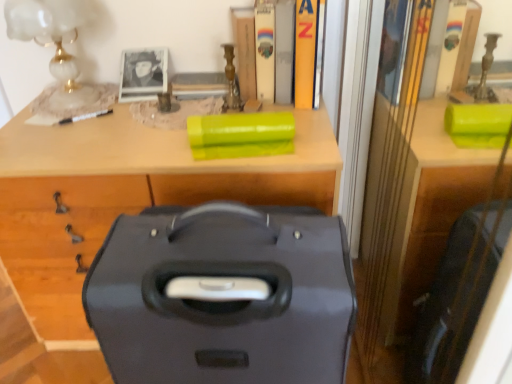
Describe the element at coordinates (245, 50) in the screenshot. I see `wooden book at upper center, the 1th book positioned from the left` at that location.

Describe the element at coordinates (53, 38) in the screenshot. The image size is (512, 384). I see `white marble table lamp at upper left` at that location.

Locate an element on the screen. white marble table lamp at upper left is located at coordinates (53, 38).

Where is `matte black suitcase at center`? The width and height of the screenshot is (512, 384). matte black suitcase at center is located at coordinates (127, 196).

Describe the element at coordinates (223, 297) in the screenshot. I see `matte black suitcase at center` at that location.

The width and height of the screenshot is (512, 384). What do you see at coordinates (265, 50) in the screenshot?
I see `hardcover book at upper center, which is counted as the third book, starting from the right` at bounding box center [265, 50].

Image resolution: width=512 pixels, height=384 pixels. I want to click on yellow matte book at upper center, the first book viewed from the right, so click(x=308, y=53).

Looking at the image, does white marble table lamp at upper left seem bigger or smaller compared to hardcover book at upper center, which is counted as the second book, starting from the right?

Considering their sizes, white marble table lamp at upper left takes up more space than hardcover book at upper center, which is counted as the second book, starting from the right.

Which is correct: white marble table lamp at upper left is inside hardcover book at upper center, which is counted as the second book, starting from the right, or outside of it?

white marble table lamp at upper left is outside hardcover book at upper center, which is counted as the second book, starting from the right.

Looking at this image, from the image's perspective, which is below, white marble table lamp at upper left or hardcover book at upper center, the third book from the left?

white marble table lamp at upper left is shown below in the image.

At what (x,y) coordinates should I click in order to perform the action: click on table lamp lying on the left of hardcover book at upper center, which is counted as the second book, starting from the right. Please return your answer as a coordinate pair (x, y). This screenshot has width=512, height=384. Looking at the image, I should click on (53, 38).

Would you say matte black suitcase at center is inside or outside hardcover book at upper center, which ranks as the 2th book in left-to-right order?

matte black suitcase at center is not enclosed by hardcover book at upper center, which ranks as the 2th book in left-to-right order.

From a real-world perspective, which is physically below, matte black suitcase at center or hardcover book at upper center, which ranks as the 2th book in left-to-right order?

matte black suitcase at center is physically lower.

From the image's perspective, is matte black suitcase at center located beneath hardcover book at upper center, which ranks as the 2th book in left-to-right order?

Correct, matte black suitcase at center appears lower than hardcover book at upper center, which ranks as the 2th book in left-to-right order, in the image.

Looking at this image, from the image's perspective, is hardcover book at upper center, which ranks as the 2th book in left-to-right order, above hardcover book at upper center, which is counted as the second book, starting from the right?

No.

Looking at this image, is hardcover book at upper center, which is counted as the third book, starting from the right, next to hardcover book at upper center, which is counted as the second book, starting from the right, and touching it?

Yes.

In the image, is hardcover book at upper center, which ranks as the 2th book in left-to-right order, on the left side or the right side of hardcover book at upper center, the third book from the left?

Based on their positions, hardcover book at upper center, which ranks as the 2th book in left-to-right order, is located to the left of hardcover book at upper center, the third book from the left.

Considering the positions of point (269, 63) and point (287, 20), is point (269, 63) closer or farther from the camera than point (287, 20)?

Clearly, point (269, 63) is more distant from the camera than point (287, 20).

From the hardcover book at upper center, which ranks as the 2th book in left-to-right order, count 2nd books forward and point to it. Please provide its 2D coordinates.

[(308, 53)]

From the image's perspective, which is below, hardcover book at upper center, which is counted as the third book, starting from the right, or yellow matte book at upper center, the first book viewed from the right?

hardcover book at upper center, which is counted as the third book, starting from the right, appears lower in the image.

Considering the relative sizes of hardcover book at upper center, which ranks as the 2th book in left-to-right order, and yellow matte book at upper center, the first book viewed from the right, in the image provided, is hardcover book at upper center, which ranks as the 2th book in left-to-right order, wider than yellow matte book at upper center, the first book viewed from the right,?

No, hardcover book at upper center, which ranks as the 2th book in left-to-right order, is not wider than yellow matte book at upper center, the first book viewed from the right.

From a real-world perspective, between hardcover book at upper center, which is counted as the third book, starting from the right, and yellow matte book at upper center, the fourth book positioned from the left, who is vertically lower?

From a 3D spatial view, hardcover book at upper center, which is counted as the third book, starting from the right, is below.

Does wooden book at upper center, the 1th book positioned from the left, appear on the left side of matte black suitcase at center?

Incorrect, wooden book at upper center, the 1th book positioned from the left, is not on the left side of matte black suitcase at center.

From the image's perspective, between wooden book at upper center, the 1th book positioned from the left, and matte black suitcase at center, which one is located above?

wooden book at upper center, the 1th book positioned from the left, is shown above in the image.

Considering their positions, is wooden book at upper center, which ranks as the fourth book in right-to-left order, located in front of or behind matte black suitcase at center?

wooden book at upper center, which ranks as the fourth book in right-to-left order, is positioned farther from the viewer than matte black suitcase at center.

Would you consider wooden book at upper center, which ranks as the fourth book in right-to-left order, to be distant from matte black suitcase at center?

No, wooden book at upper center, which ranks as the fourth book in right-to-left order, is not far from matte black suitcase at center.

How many degrees apart are the facing directions of yellow matte book at upper center, the fourth book positioned from the left, and wooden book at upper center, which ranks as the fourth book in right-to-left order?

They differ by 6.99 degrees in their facing directions.

Can you confirm if yellow matte book at upper center, the first book viewed from the right, is smaller than wooden book at upper center, the 1th book positioned from the left?

Incorrect, yellow matte book at upper center, the first book viewed from the right, is not smaller in size than wooden book at upper center, the 1th book positioned from the left.

Can you confirm if yellow matte book at upper center, the first book viewed from the right, is taller than wooden book at upper center, which ranks as the fourth book in right-to-left order?

Correct, yellow matte book at upper center, the first book viewed from the right, is much taller as wooden book at upper center, which ranks as the fourth book in right-to-left order.

From the image's perspective, count 3rd books upward from the wooden book at upper center, which ranks as the fourth book in right-to-left order, and point to it. Please provide its 2D coordinates.

[(308, 53)]

Who is taller, yellow matte book at upper center, the first book viewed from the right, or matte black suitcase at center?

matte black suitcase at center.

From a real-world perspective, which object rests below the other?

matte black suitcase at center, from a real-world perspective.

Where is `table lamp that is on the left side of hardcover book at upper center, which is counted as the second book, starting from the right`? The height and width of the screenshot is (384, 512). table lamp that is on the left side of hardcover book at upper center, which is counted as the second book, starting from the right is located at coordinates (53, 38).

Find the location of `desk below the hardcover book at upper center, which is counted as the third book, starting from the right (from a real-world perspective)`. desk below the hardcover book at upper center, which is counted as the third book, starting from the right (from a real-world perspective) is located at coordinates (127, 196).

Estimate the real-world distances between objects in this image. Which object is closer to wooden book at upper center, which ranks as the fourth book in right-to-left order, white marble table lamp at upper left or matte black suitcase at center?

white marble table lamp at upper left is positioned closer to the anchor wooden book at upper center, which ranks as the fourth book in right-to-left order.

Consider the image. From the image, which object appears to be farther from hardcover book at upper center, which ranks as the 2th book in left-to-right order, matte black suitcase at center or yellow matte book at upper center, the first book viewed from the right?

Based on the image, matte black suitcase at center appears to be further to hardcover book at upper center, which ranks as the 2th book in left-to-right order.

Which object lies nearer to the anchor point yellow matte book at upper center, the fourth book positioned from the left, matte black suitcase at center or white marble table lamp at upper left?

The object closer to yellow matte book at upper center, the fourth book positioned from the left, is white marble table lamp at upper left.

Estimate the real-world distances between objects in this image. Which object is closer to matte black suitcase at center, wooden book at upper center, the 1th book positioned from the left, or matte black suitcase at center?

matte black suitcase at center.

Looking at the image, which one is located further to wooden book at upper center, the 1th book positioned from the left, white marble table lamp at upper left or hardcover book at upper center, the third book from the left?

Based on the image, white marble table lamp at upper left appears to be further to wooden book at upper center, the 1th book positioned from the left.

Which object lies nearer to the anchor point hardcover book at upper center, which ranks as the 2th book in left-to-right order, matte black suitcase at center or matte black suitcase at center?

The object closer to hardcover book at upper center, which ranks as the 2th book in left-to-right order, is matte black suitcase at center.

Consider the image. From the image, which object appears to be nearer to white marble table lamp at upper left, matte black suitcase at center or matte black suitcase at center?

matte black suitcase at center is closer to white marble table lamp at upper left.

Estimate the real-world distances between objects in this image. Which object is closer to wooden book at upper center, which ranks as the fourth book in right-to-left order, hardcover book at upper center, which ranks as the 2th book in left-to-right order, or matte black suitcase at center?

hardcover book at upper center, which ranks as the 2th book in left-to-right order, is positioned closer to the anchor wooden book at upper center, which ranks as the fourth book in right-to-left order.

At what (x,y) coordinates should I click in order to perform the action: click on book between white marble table lamp at upper left and hardcover book at upper center, which ranks as the 2th book in left-to-right order. Please return your answer as a coordinate pair (x, y). This screenshot has width=512, height=384. Looking at the image, I should click on (245, 50).

Locate an element on the screen. The height and width of the screenshot is (384, 512). desk between hardcover book at upper center, the third book from the left, and matte black suitcase at center, in the vertical direction is located at coordinates (127, 196).

Identify the location of book between hardcover book at upper center, which ranks as the 2th book in left-to-right order, and matte black suitcase at center vertically. Image resolution: width=512 pixels, height=384 pixels. (245, 50).

The image size is (512, 384). What are the coordinates of `book located between wooden book at upper center, which ranks as the fourth book in right-to-left order, and hardcover book at upper center, which is counted as the second book, starting from the right, in the left-right direction` in the screenshot? It's located at pos(265,50).